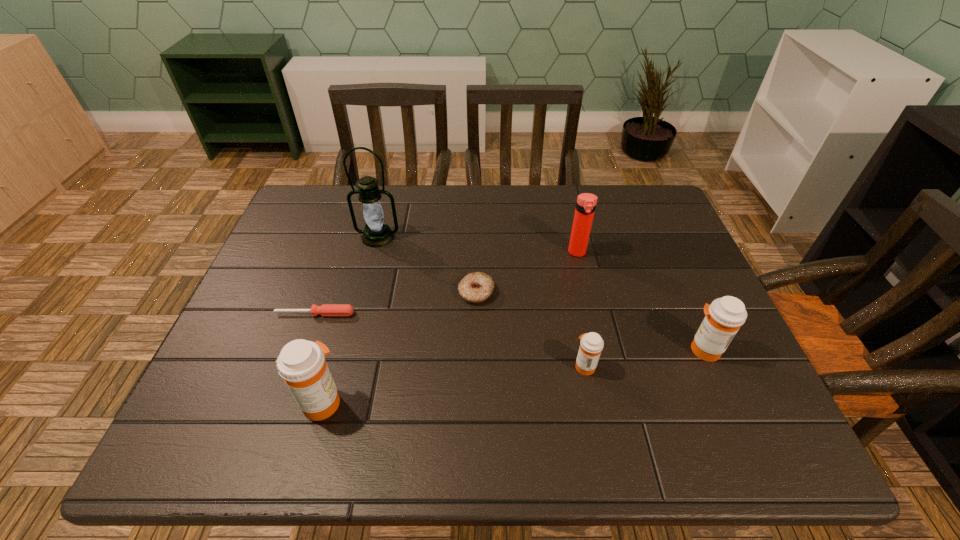
In order to click on the closest medicine relative to the shortest medicine in this screenshot , I will do `click(723, 318)`.

Where is `free location that satisfies the following two spatial constraints: 1. on the side where the thermos bottle emits light; 2. on the left side of the lantern`? This screenshot has width=960, height=540. free location that satisfies the following two spatial constraints: 1. on the side where the thermos bottle emits light; 2. on the left side of the lantern is located at coordinates (374, 253).

The image size is (960, 540). I want to click on vacant space that satisfies the following two spatial constraints: 1. on the side where the lantern emits light; 2. on the left side of the second shortest medicine, so click(x=349, y=350).

At what (x,y) coordinates should I click in order to perform the action: click on free space in the image that satisfies the following two spatial constraints: 1. on the side where the tallest object emits light; 2. on the left side of the second tallest medicine. Please return your answer as a coordinate pair (x, y). Image resolution: width=960 pixels, height=540 pixels. Looking at the image, I should click on (349, 350).

At what (x,y) coordinates should I click in order to perform the action: click on vacant area that satisfies the following two spatial constraints: 1. on the front side of the second shortest medicine; 2. on the right side of the sixth tallest object. Please return your answer as a coordinate pair (x, y). The width and height of the screenshot is (960, 540). Looking at the image, I should click on (476, 350).

You are a GUI agent. You are given a task and a screenshot of the screen. Output one action in this format:
    pyautogui.click(x=<x>, y=<y>)
    Task: Click on the free space that satisfies the following two spatial constraints: 1. on the back side of the nearest object; 2. on the right side of the doughnut
    Image resolution: width=960 pixels, height=540 pixels.
    Given the screenshot: What is the action you would take?
    pyautogui.click(x=353, y=293)